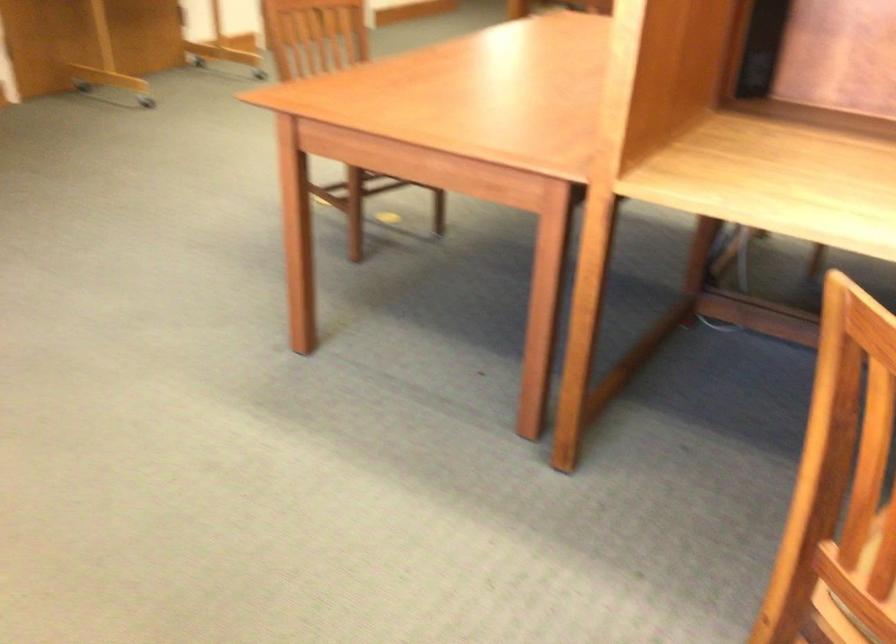
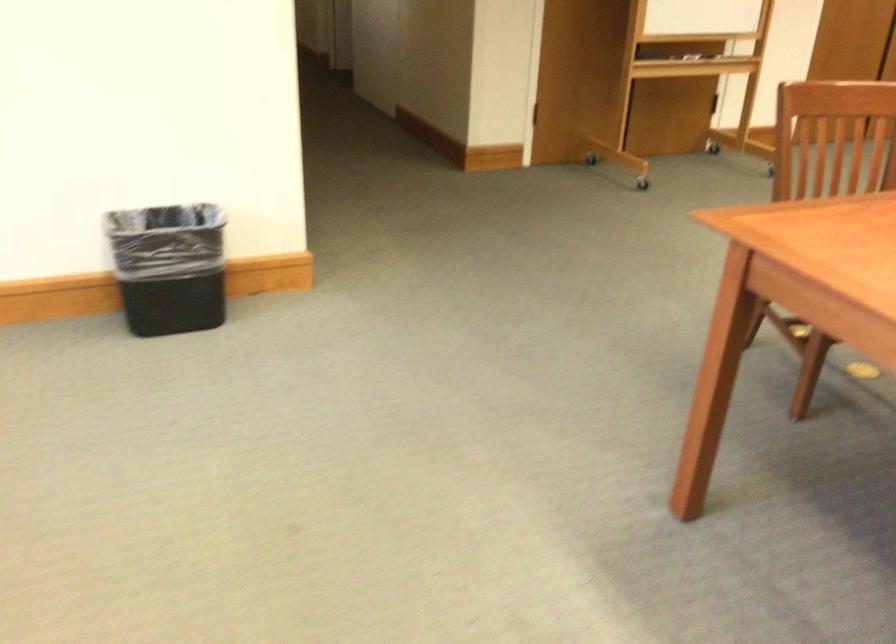
In the second image, find the point that corresponds to (365,89) in the first image.

(849, 220)